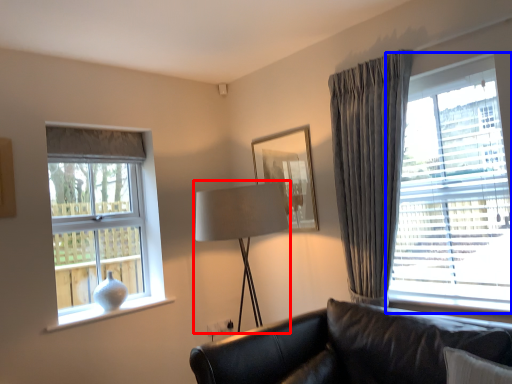
Question: Which of the following is the closest to the observer, table lamp (highlighted by a red box) or window (highlighted by a blue box)?

Choices:
 (A) table lamp
 (B) window

Answer: (B)